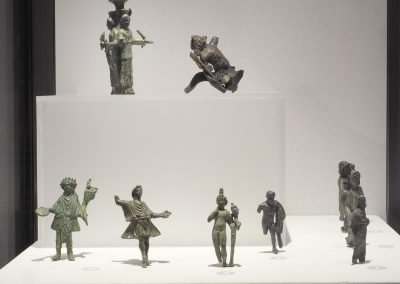
Identify the location of white floor. Image resolution: width=400 pixels, height=284 pixels. (291, 261).